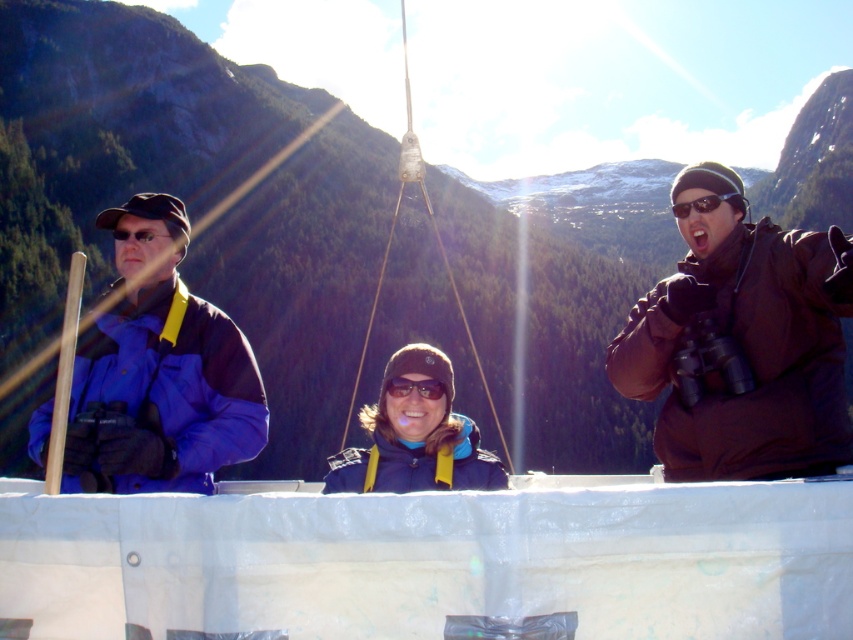
You are a photographer trying to capture a candid shot of the blue fabric jacket at left and the black matte sunglasses at upper right. Since you want to frame both subjects in the same photo, can you confirm if one is positioned above the other?

The blue fabric jacket at left is located below the black matte sunglasses at upper right, so yes, the black matte sunglasses at upper right is positioned above the blue fabric jacket at left. This allows both subjects to be captured in the same frame with the sunglasses above the jacket.

You are a photographer trying to capture a group photo of the brown matte jacket at right and the purple matte goggles at center. The camera you have can focus on subjects within a 8 meter range. Will both subjects be in focus if you position yourself equidistant from both?

The distance between the brown matte jacket at right and purple matte goggles at center is 10.14 meters. If you are equidistant from both, you would be 5.07 meters away from each. Since the camera can focus within 8 meters, both subjects will be within the focus range and thus in focus.